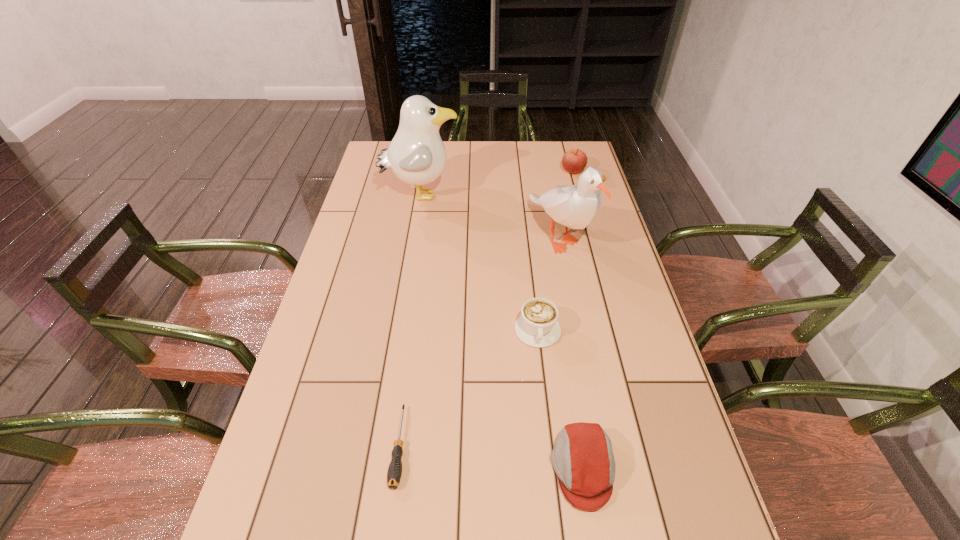
Identify the location of vacant space situated 0.070m on the back of the farthest object. The height and width of the screenshot is (540, 960). (568, 156).

You are a GUI agent. You are given a task and a screenshot of the screen. Output one action in this format:
    pyautogui.click(x=<x>, y=<y>)
    Task: Click on the free space located on the front-facing side of the cap
    The height and width of the screenshot is (540, 960).
    Given the screenshot: What is the action you would take?
    pyautogui.click(x=526, y=468)

This screenshot has width=960, height=540. Identify the location of vacant area situated 0.300m on the front-facing side of the cap. (404, 468).

Where is `vacant position located on the front-facing side of the cap`? vacant position located on the front-facing side of the cap is located at coordinates (448, 468).

At what (x,y) coordinates should I click in order to perform the action: click on blank area located 0.340m to the right of the cappuccino's handle. Please return your answer as a coordinate pair (x, y). This screenshot has width=960, height=540. Looking at the image, I should click on (557, 492).

Where is `vacant space situated 0.330m on the back of the screwdriver`? The image size is (960, 540). vacant space situated 0.330m on the back of the screwdriver is located at coordinates (419, 300).

The height and width of the screenshot is (540, 960). Find the location of `object that is positioned at the far edge`. object that is positioned at the far edge is located at coordinates (574, 161).

Image resolution: width=960 pixels, height=540 pixels. In order to click on object that is positioned at the left edge in this screenshot , I will do `click(416, 155)`.

At what (x,y) coordinates should I click in order to perform the action: click on gull positioned at the right edge. Please return your answer as a coordinate pair (x, y). Looking at the image, I should click on (574, 206).

At what (x,y) coordinates should I click in order to perform the action: click on apple located at the right edge. Please return your answer as a coordinate pair (x, y). The image size is (960, 540). Looking at the image, I should click on (574, 161).